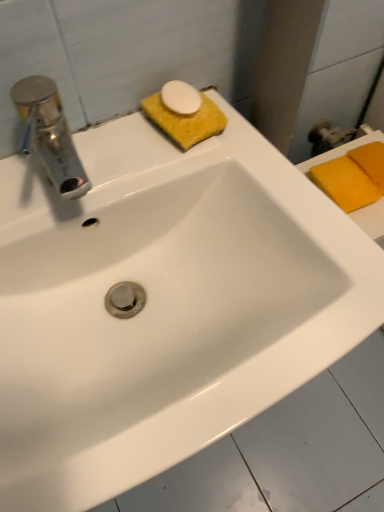
Locate an element on the screen. The image size is (384, 512). orange sponge at upper right, the second soap positioned from the back is located at coordinates (345, 183).

This screenshot has width=384, height=512. What do you see at coordinates (184, 114) in the screenshot?
I see `yellow sponge at upper center, which is the 3th soap in back-to-front order` at bounding box center [184, 114].

Locate an element on the screen. The image size is (384, 512). yellow sponge at upper center, the 3th soap viewed from the right is located at coordinates (184, 114).

Find the location of `orange sponge at upper right, acting as the second soap starting from the left`. orange sponge at upper right, acting as the second soap starting from the left is located at coordinates (345, 183).

Is orange sponge at upper right, acting as the second soap starting from the left, directly adjacent to yellow sponge at upper center, positioned as the 1th soap in left-to-right order?

No, orange sponge at upper right, acting as the second soap starting from the left, is not with yellow sponge at upper center, positioned as the 1th soap in left-to-right order.

In the scene shown: How different are the orientations of orange sponge at upper right, arranged as the 2th soap when viewed from the front, and yellow sponge at upper center, which is the 3th soap in back-to-front order, in degrees?

The facing directions of orange sponge at upper right, arranged as the 2th soap when viewed from the front, and yellow sponge at upper center, which is the 3th soap in back-to-front order, are 6.77 degrees apart.

Is orange sponge at upper right, acting as the second soap starting from the left, wider or thinner than yellow sponge at upper center, the 3th soap viewed from the right?

orange sponge at upper right, acting as the second soap starting from the left, is wider than yellow sponge at upper center, the 3th soap viewed from the right.

Does orange sponge at upper right, acting as the second soap starting from the left, lie behind yellow sponge at upper center, the 3th soap viewed from the right?

That is True.

Where is `soap on the right of orange sponge at upper right, the second soap when ordered from right to left`? This screenshot has height=512, width=384. soap on the right of orange sponge at upper right, the second soap when ordered from right to left is located at coordinates (370, 162).

From the image's perspective, is yellow sponge at right, positioned as the 3th soap in left-to-right order, on top of orange sponge at upper right, arranged as the 2th soap when viewed from the front?

Yes, from the image's perspective, yellow sponge at right, positioned as the 3th soap in left-to-right order, is over orange sponge at upper right, arranged as the 2th soap when viewed from the front.

Is yellow sponge at right, acting as the first soap starting from the right, positioned far away from orange sponge at upper right, the second soap when ordered from right to left?

yellow sponge at right, acting as the first soap starting from the right, is near orange sponge at upper right, the second soap when ordered from right to left, not far away.

What's the angular difference between yellow sponge at right, the third soap from the front, and orange sponge at upper right, acting as the second soap starting from the left,'s facing directions?

0.000853 degrees.

Considering the positions of point (157, 116) and point (366, 168), is point (157, 116) closer or farther from the camera than point (366, 168)?

Point (157, 116).

Considering the relative sizes of yellow sponge at upper center, acting as the 1th soap starting from the front, and yellow sponge at right, the third soap from the front, in the image provided, is yellow sponge at upper center, acting as the 1th soap starting from the front, wider than yellow sponge at right, the third soap from the front,?

No.

In the scene shown: Is yellow sponge at upper center, acting as the 1th soap starting from the front, facing away from yellow sponge at right, the third soap from the front?

No, yellow sponge at upper center, acting as the 1th soap starting from the front, is not facing the opposite direction of yellow sponge at right, the third soap from the front.

From the image's perspective, is yellow sponge at upper center, which is the 3th soap in back-to-front order, below yellow sponge at right, which is the 1th soap in back-to-front order?

No, from the image's perspective, yellow sponge at upper center, which is the 3th soap in back-to-front order, is not below yellow sponge at right, which is the 1th soap in back-to-front order.

What's the angular difference between yellow sponge at right, which is the 1th soap in back-to-front order, and yellow sponge at upper center, the 3th soap viewed from the right,'s facing directions?

They differ by 6.77 degrees in their facing directions.

Which object is wider, yellow sponge at right, positioned as the 3th soap in left-to-right order, or yellow sponge at upper center, the 3th soap viewed from the right?

yellow sponge at right, positioned as the 3th soap in left-to-right order, is wider.

Is yellow sponge at right, acting as the first soap starting from the right, aimed at yellow sponge at upper center, the 3th soap viewed from the right?

No, yellow sponge at right, acting as the first soap starting from the right, is not turned towards yellow sponge at upper center, the 3th soap viewed from the right.

Which object is positioned more to the right, yellow sponge at right, the third soap from the front, or yellow sponge at upper center, the 3th soap viewed from the right?

yellow sponge at right, the third soap from the front.

Who is taller, orange sponge at upper right, the second soap positioned from the back, or yellow sponge at right, positioned as the 3th soap in left-to-right order?

orange sponge at upper right, the second soap positioned from the back.

From the image's perspective, which is above, orange sponge at upper right, the second soap positioned from the back, or yellow sponge at right, positioned as the 3th soap in left-to-right order?

From the image's view, yellow sponge at right, positioned as the 3th soap in left-to-right order, is above.

Are orange sponge at upper right, the second soap positioned from the back, and yellow sponge at right, which is the 1th soap in back-to-front order, making contact?

Absolutely, orange sponge at upper right, the second soap positioned from the back, is next to and touching yellow sponge at right, which is the 1th soap in back-to-front order.

Is yellow sponge at upper center, acting as the 1th soap starting from the front, taller or shorter than orange sponge at upper right, arranged as the 2th soap when viewed from the front?

Clearly, yellow sponge at upper center, acting as the 1th soap starting from the front, is shorter compared to orange sponge at upper right, arranged as the 2th soap when viewed from the front.

Are yellow sponge at upper center, positioned as the 1th soap in left-to-right order, and orange sponge at upper right, arranged as the 2th soap when viewed from the front, located far from each other?

Actually, yellow sponge at upper center, positioned as the 1th soap in left-to-right order, and orange sponge at upper right, arranged as the 2th soap when viewed from the front, are a little close together.

Visually, is yellow sponge at upper center, the 3th soap viewed from the right, positioned to the left or to the right of orange sponge at upper right, acting as the second soap starting from the left?

yellow sponge at upper center, the 3th soap viewed from the right, is to the left of orange sponge at upper right, acting as the second soap starting from the left.

From a real-world perspective, who is located higher, yellow sponge at upper center, which is the 3th soap in back-to-front order, or orange sponge at upper right, the second soap positioned from the back?

In real-world perspective, yellow sponge at upper center, which is the 3th soap in back-to-front order, is above.

What are the coordinates of `the 1st soap behind the yellow sponge at upper center, the 3th soap viewed from the right` in the screenshot? It's located at (345, 183).

You are a GUI agent. You are given a task and a screenshot of the screen. Output one action in this format:
    pyautogui.click(x=<x>, y=<y>)
    Task: Click on the soap below the yellow sponge at right, the third soap from the front (from the image's perspective)
    The width and height of the screenshot is (384, 512).
    Given the screenshot: What is the action you would take?
    pyautogui.click(x=345, y=183)

Looking at the image, which one is located further to orange sponge at upper right, the second soap when ordered from right to left, yellow sponge at upper center, acting as the 1th soap starting from the front, or yellow sponge at right, positioned as the 3th soap in left-to-right order?

yellow sponge at upper center, acting as the 1th soap starting from the front, is positioned further to the anchor orange sponge at upper right, the second soap when ordered from right to left.

Which object lies further to the anchor point yellow sponge at right, acting as the first soap starting from the right, orange sponge at upper right, the second soap positioned from the back, or yellow sponge at upper center, positioned as the 1th soap in left-to-right order?

Based on the image, yellow sponge at upper center, positioned as the 1th soap in left-to-right order, appears to be further to yellow sponge at right, acting as the first soap starting from the right.

When comparing their distances from yellow sponge at right, acting as the first soap starting from the right, does yellow sponge at upper center, positioned as the 1th soap in left-to-right order, or orange sponge at upper right, the second soap when ordered from right to left, seem closer?

Among the two, orange sponge at upper right, the second soap when ordered from right to left, is located nearer to yellow sponge at right, acting as the first soap starting from the right.

Looking at the image, which one is located closer to orange sponge at upper right, the second soap when ordered from right to left, yellow sponge at right, which is the 1th soap in back-to-front order, or yellow sponge at upper center, positioned as the 1th soap in left-to-right order?

yellow sponge at right, which is the 1th soap in back-to-front order.

Estimate the real-world distances between objects in this image. Which object is further from yellow sponge at upper center, acting as the 1th soap starting from the front, orange sponge at upper right, acting as the second soap starting from the left, or yellow sponge at right, positioned as the 3th soap in left-to-right order?

yellow sponge at right, positioned as the 3th soap in left-to-right order.

Considering their positions, is yellow sponge at right, acting as the first soap starting from the right, positioned further to yellow sponge at upper center, the 3th soap viewed from the right, than orange sponge at upper right, the second soap when ordered from right to left?

Based on the image, yellow sponge at right, acting as the first soap starting from the right, appears to be further to yellow sponge at upper center, the 3th soap viewed from the right.

You are a GUI agent. You are given a task and a screenshot of the screen. Output one action in this format:
    pyautogui.click(x=<x>, y=<y>)
    Task: Click on the soap between yellow sponge at upper center, which is the 3th soap in back-to-front order, and yellow sponge at right, which is the 1th soap in back-to-front order, from left to right
    Image resolution: width=384 pixels, height=512 pixels.
    Given the screenshot: What is the action you would take?
    pyautogui.click(x=345, y=183)